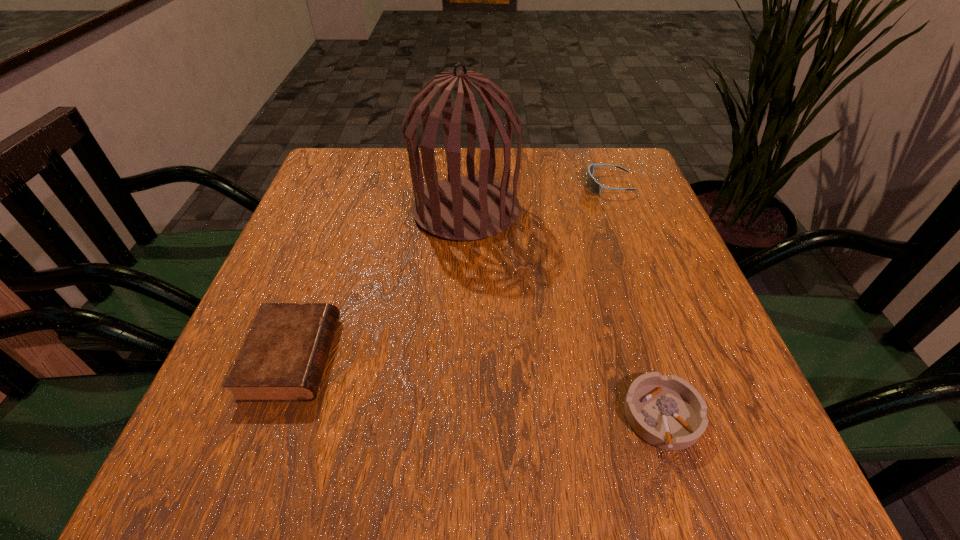
Image resolution: width=960 pixels, height=540 pixels. Find the location of `free spot between the diary and the ashtray`. free spot between the diary and the ashtray is located at coordinates (x=477, y=387).

Find the location of `empty space that is in between the shortest object and the leftmost object`. empty space that is in between the shortest object and the leftmost object is located at coordinates (477, 387).

At what (x,y) coordinates should I click in order to perform the action: click on unoccupied position between the tallest object and the goggles. Please return your answer as a coordinate pair (x, y). The width and height of the screenshot is (960, 540). Looking at the image, I should click on (538, 198).

Image resolution: width=960 pixels, height=540 pixels. In order to click on unoccupied area between the goggles and the diary in this screenshot , I will do `click(450, 271)`.

Identify which object is located as the nearest to the goggles. Please provide its 2D coordinates. Your answer should be formatted as a tuple, i.e. [(x, y)], where the tuple contains the x and y coordinates of a point satisfying the conditions above.

[(464, 208)]

Identify the location of the second closest object to the shortest object. (283, 357).

Where is `free space that satisfies the following two spatial constraints: 1. on the spine side of the diary; 2. on the right side of the ashtray`? Image resolution: width=960 pixels, height=540 pixels. free space that satisfies the following two spatial constraints: 1. on the spine side of the diary; 2. on the right side of the ashtray is located at coordinates (271, 417).

I want to click on free space that satisfies the following two spatial constraints: 1. on the spine side of the leftmost object; 2. on the right side of the ashtray, so click(271, 417).

Where is `vacant space that satisfies the following two spatial constraints: 1. on the front side of the second object from left to right; 2. on the left side of the shortest object`? This screenshot has height=540, width=960. vacant space that satisfies the following two spatial constraints: 1. on the front side of the second object from left to right; 2. on the left side of the shortest object is located at coordinates (459, 417).

Identify the location of free space that satisfies the following two spatial constraints: 1. on the front side of the birdcage; 2. on the spine side of the diary. (461, 357).